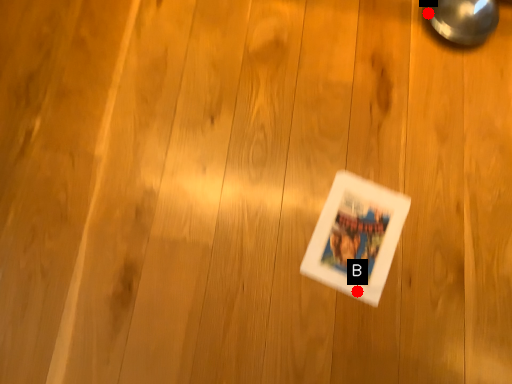
Question: Two points are circled on the image, labeled by A and B beside each circle. Which of the following is the farthest from the observer?

Choices:
 (A) A is further
 (B) B is further

Answer: (A)